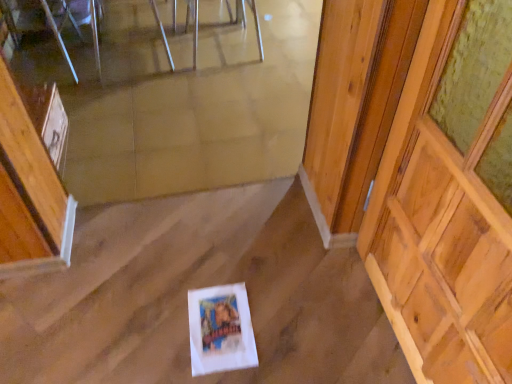
Question: Does wooden at right have a greater width compared to clear glass table at upper center?

Choices:
 (A) yes
 (B) no

Answer: (B)

Question: Is wooden at right at the right side of clear glass table at upper center?

Choices:
 (A) yes
 (B) no

Answer: (A)

Question: Is wooden at right positioned beyond the bounds of clear glass table at upper center?

Choices:
 (A) no
 (B) yes

Answer: (B)

Question: Considering the relative sizes of wooden at right and clear glass table at upper center in the image provided, is wooden at right shorter than clear glass table at upper center?

Choices:
 (A) yes
 (B) no

Answer: (B)

Question: From a real-world perspective, is wooden at right under clear glass table at upper center?

Choices:
 (A) yes
 (B) no

Answer: (B)

Question: Is clear glass table at upper center spatially inside wooden at right, or outside of it?

Choices:
 (A) inside
 (B) outside

Answer: (B)

Question: Visually, is clear glass table at upper center positioned to the left or to the right of wooden at right?

Choices:
 (A) right
 (B) left

Answer: (B)

Question: From a real-world perspective, is clear glass table at upper center physically located above or below wooden at right?

Choices:
 (A) below
 (B) above

Answer: (A)

Question: Considering the positions of clear glass table at upper center and wooden at right in the image, is clear glass table at upper center wider or thinner than wooden at right?

Choices:
 (A) wide
 (B) thin

Answer: (A)

Question: From their relative heights in the image, would you say clear glass table at upper center is taller or shorter than metallic reflective chair at upper center, the first chair positioned from the right?

Choices:
 (A) tall
 (B) short

Answer: (B)

Question: From a real-world perspective, relative to metallic reflective chair at upper center, which is the 2th chair in left-to-right order, is clear glass table at upper center vertically above or below?

Choices:
 (A) below
 (B) above

Answer: (A)

Question: Is clear glass table at upper center inside the boundaries of metallic reflective chair at upper center, which is the 2th chair in left-to-right order, or outside?

Choices:
 (A) outside
 (B) inside

Answer: (A)

Question: Visually, is clear glass table at upper center positioned to the left or to the right of metallic reflective chair at upper center, which is the 2th chair in left-to-right order?

Choices:
 (A) right
 (B) left

Answer: (B)

Question: Is metallic silver chair at upper center, which is the second chair in right-to-left order, wider or thinner than metallic reflective chair at upper center, the first chair positioned from the right?

Choices:
 (A) wide
 (B) thin

Answer: (A)

Question: Looking at the image, does metallic silver chair at upper center, which is the first chair from left to right, seem bigger or smaller compared to metallic reflective chair at upper center, the first chair positioned from the right?

Choices:
 (A) big
 (B) small

Answer: (A)